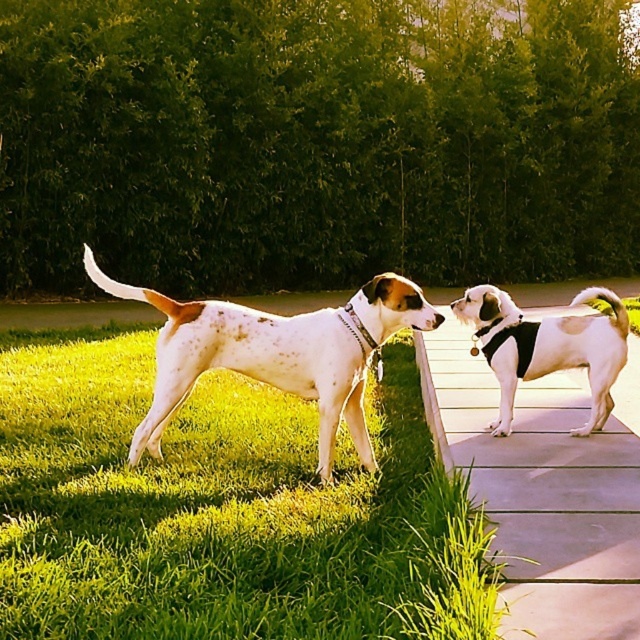
Question: Which object is closer to the camera taking this photo?

Choices:
 (A) concrete paving at center
 (B) green grass at lower left

Answer: (B)

Question: Is green grass at lower left behind concrete paving at center?

Choices:
 (A) no
 (B) yes

Answer: (A)

Question: Which object is positioned closest to the green grass at lower left?

Choices:
 (A) concrete paving at center
 (B) speckled white dog at center

Answer: (B)

Question: Does green grass at lower left appear on the right side of concrete paving at center?

Choices:
 (A) yes
 (B) no

Answer: (B)

Question: Which point is closer to the camera taking this photo?

Choices:
 (A) (328, 308)
 (B) (45, 410)

Answer: (A)

Question: Is concrete paving at center thinner than speckled white dog at center?

Choices:
 (A) no
 (B) yes

Answer: (B)